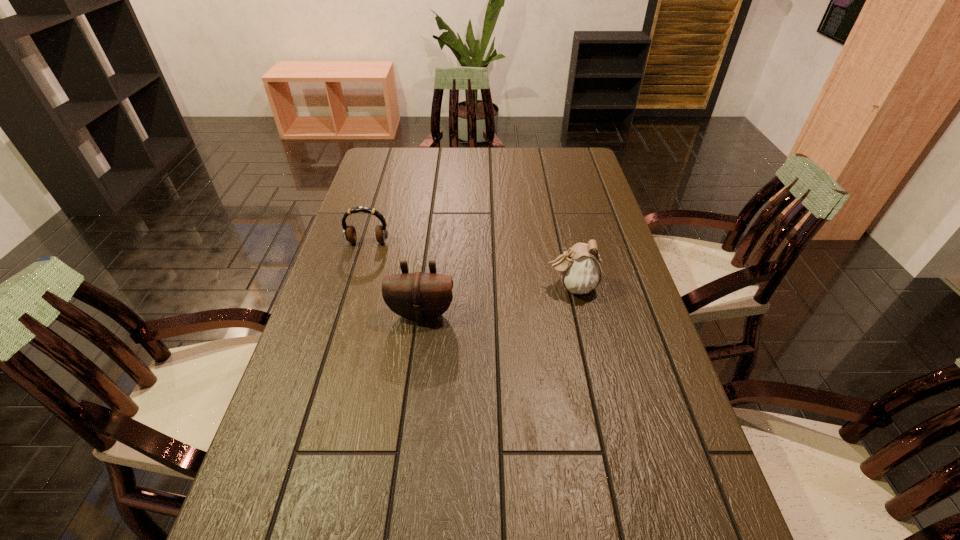
I want to click on the rightmost object, so click(x=580, y=269).

This screenshot has width=960, height=540. Find the location of `the second object from right to left`. the second object from right to left is located at coordinates (418, 296).

Locate an element on the screen. headset is located at coordinates coord(349,233).

This screenshot has width=960, height=540. Identify the location of the shortest object. (349, 233).

What are the coordinates of `vacant space situated 0.330m on the front-facing side of the rightmost object` in the screenshot? It's located at (x=430, y=287).

Locate an element on the screen. The height and width of the screenshot is (540, 960). free space located 0.250m on the front-facing side of the rightmost object is located at coordinates click(459, 287).

This screenshot has height=540, width=960. I want to click on free space located on the front-facing side of the rightmost object, so click(497, 287).

Locate an element on the screen. The width and height of the screenshot is (960, 540). vacant area situated with the flap open on the second object from right to left is located at coordinates (407, 427).

At what (x,y) coordinates should I click in order to perform the action: click on free spot located 0.230m on the ear cup of the headset. Please return your answer as a coordinate pair (x, y). Image resolution: width=960 pixels, height=540 pixels. Looking at the image, I should click on (350, 299).

The width and height of the screenshot is (960, 540). I want to click on object present at the left edge, so click(349, 233).